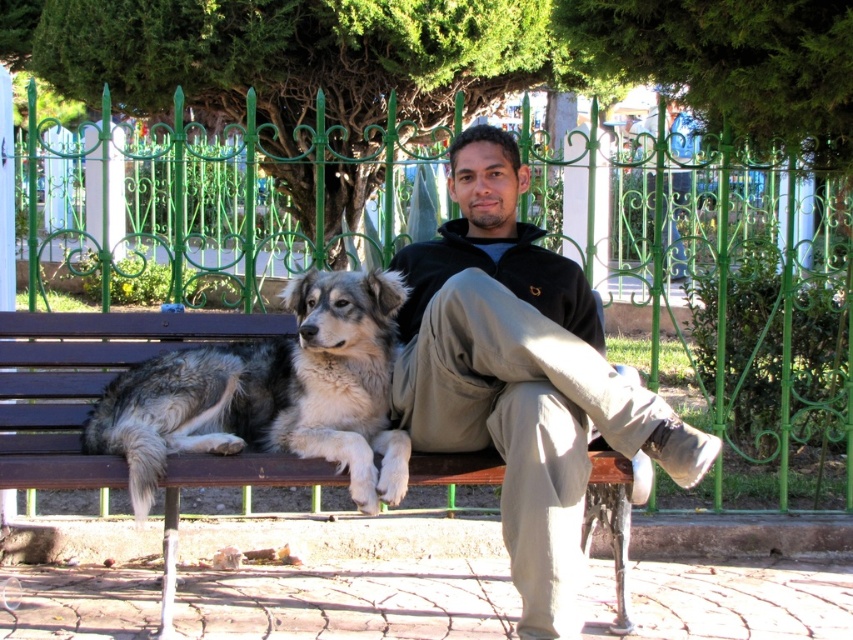
Question: Which object is farther from the camera taking this photo?

Choices:
 (A) black fleece jacket at center
 (B) gray-furred dog at center

Answer: (B)

Question: Can you confirm if black fleece jacket at center is smaller than gray-furred dog at center?

Choices:
 (A) no
 (B) yes

Answer: (A)

Question: Considering the real-world distances, which object is farthest from the gray-furred dog at center?

Choices:
 (A) black fleece jacket at center
 (B) brown wooden bench at center

Answer: (A)

Question: Is black fleece jacket at center wider than gray-furred dog at center?

Choices:
 (A) no
 (B) yes

Answer: (A)

Question: Which point is closer to the camera?

Choices:
 (A) gray-furred dog at center
 (B) brown wooden bench at center

Answer: (A)

Question: Does black fleece jacket at center appear under brown wooden bench at center?

Choices:
 (A) no
 (B) yes

Answer: (A)